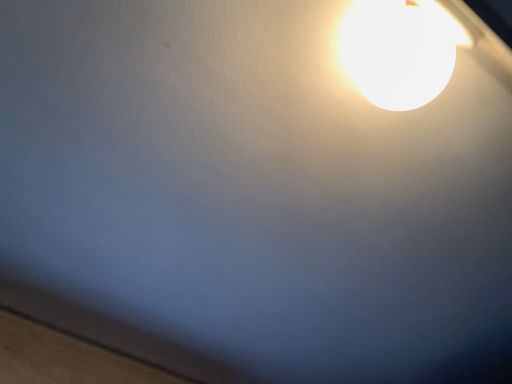
Find the location of a particular element. The width and height of the screenshot is (512, 384). white glossy lampshade at upper right is located at coordinates pyautogui.click(x=398, y=51).

What do you see at coordinates (398, 51) in the screenshot? The width and height of the screenshot is (512, 384). I see `white glossy lampshade at upper right` at bounding box center [398, 51].

You are a GUI agent. You are given a task and a screenshot of the screen. Output one action in this format:
    pyautogui.click(x=<x>, y=<y>)
    Task: Click on the white glossy lampshade at upper right
    This screenshot has height=384, width=512.
    Given the screenshot: What is the action you would take?
    pyautogui.click(x=398, y=51)